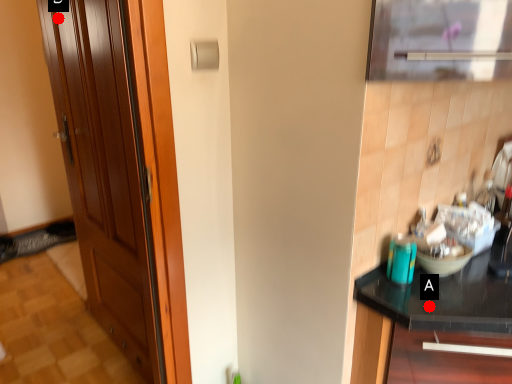
Question: Two points are circled on the image, labeled by A and B beside each circle. Which point is farther to the camera?

Choices:
 (A) A is further
 (B) B is further

Answer: (B)